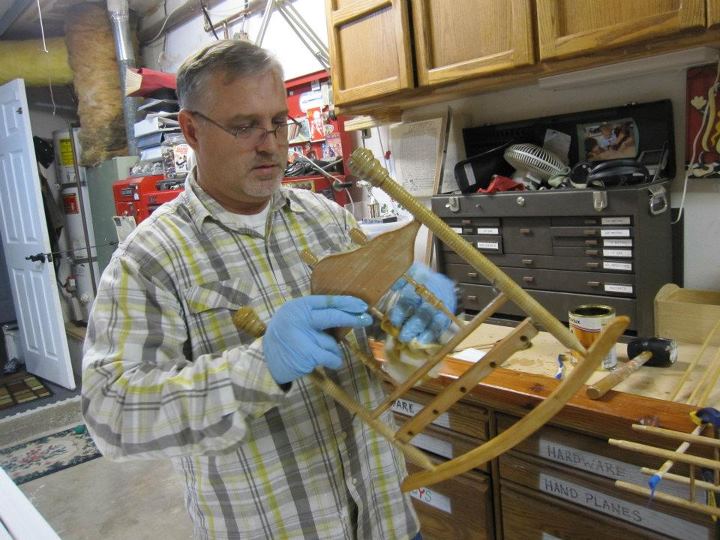
Locate an element on the screen. fan is located at coordinates (535, 158).